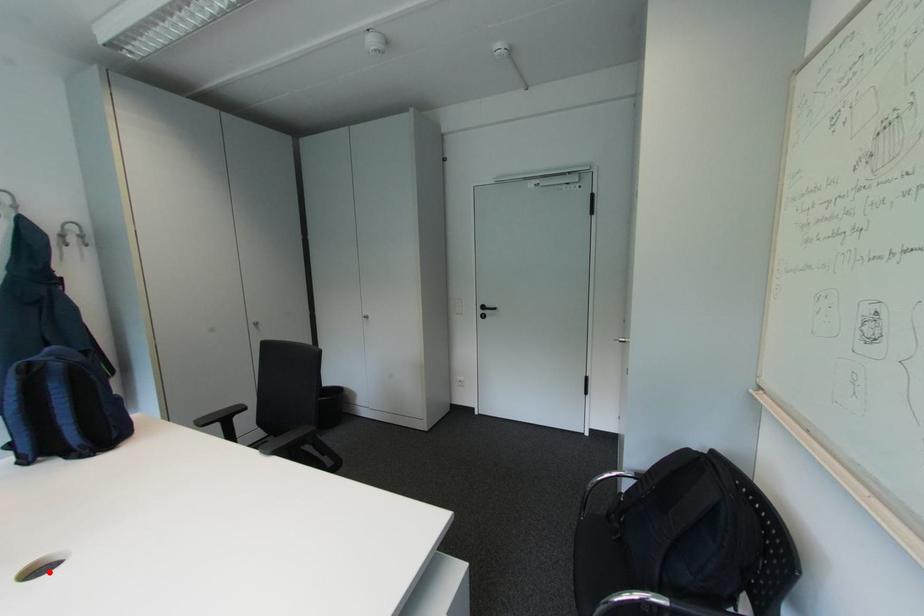
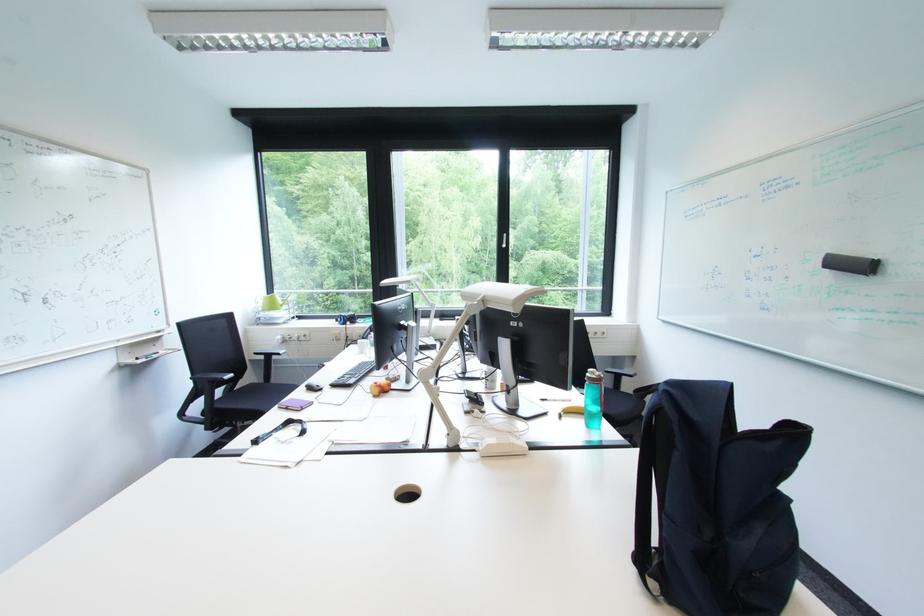
Locate, in the second image, the point that corresponds to the highlighted location in the first image.

(418, 496)